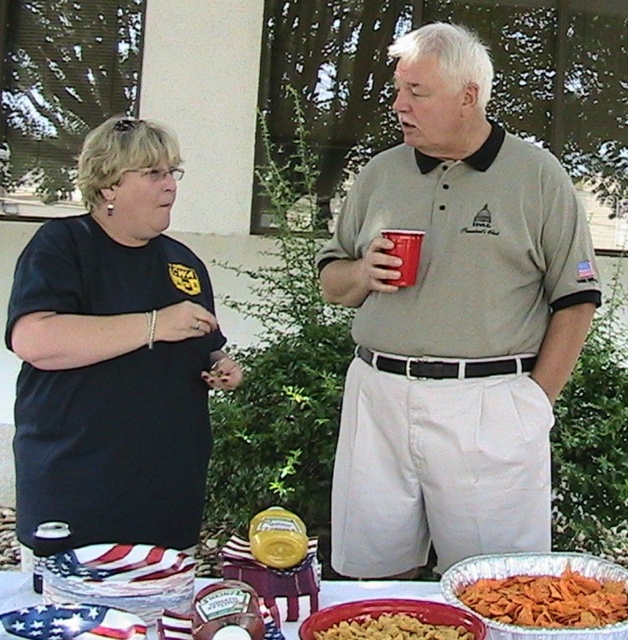
You are planning to place the yellow matte pasta at center and the matte plastic cup at upper center on a narrow shelf. Which object should you place first to ensure both fit?

You should place the yellow matte pasta at center first because it might be wider than the matte plastic cup at upper center. Placing the wider item first allows you to fit the narrower one next.

You are a guest at a picnic and want to reach for the yellow matte pasta at center. There is a metallic silver tray at lower center in the way. Can you easily access the pasta without moving the tray?

The yellow matte pasta at center is behind the metallic silver tray at lower center, so you cannot easily access it without moving the tray.

You are at a picnic and need to place a new bowl on the metallic silver tray at lower center. The tray is located at coordinates point (376, 589). Can you confirm if there is enough space on the tray at those coordinates to place the bowl?

The point (376, 589) marks the metallic silver tray at lower center, so placing the bowl there would be appropriate as it directly targets the tray.